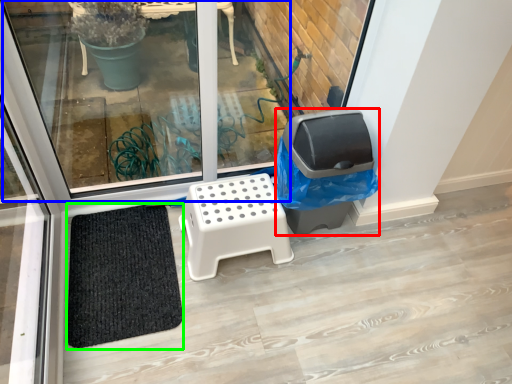
Question: Based on their relative distances, which object is farther from garbage (highlighted by a red box)? Choose from window (highlighted by a blue box) and doormat (highlighted by a green box).

Choices:
 (A) window
 (B) doormat

Answer: (A)